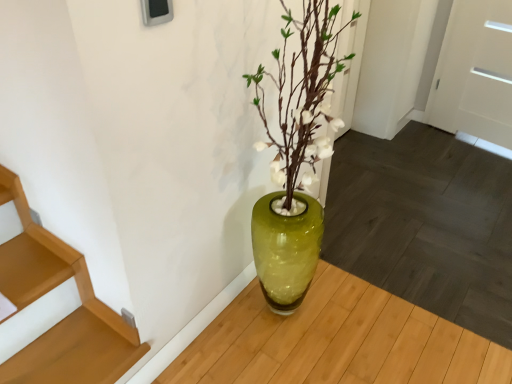
Question: Looking at the image, does wooden stairs at lower left seem bigger or smaller compared to white matte door at upper right?

Choices:
 (A) big
 (B) small

Answer: (B)

Question: Is wooden stairs at lower left in front of or behind white matte door at upper right in the image?

Choices:
 (A) behind
 (B) front

Answer: (B)

Question: Considering the relative positions of wooden stairs at lower left and white matte door at upper right in the image provided, is wooden stairs at lower left to the left or to the right of white matte door at upper right?

Choices:
 (A) right
 (B) left

Answer: (B)

Question: Is point (490, 125) closer or farther from the camera than point (95, 342)?

Choices:
 (A) farther
 (B) closer

Answer: (A)

Question: In the image, is white matte door at upper right positioned in front of or behind wooden stairs at lower left?

Choices:
 (A) behind
 (B) front

Answer: (A)

Question: Looking at their shapes, would you say white matte door at upper right is wider or thinner than wooden stairs at lower left?

Choices:
 (A) wide
 (B) thin

Answer: (B)

Question: From the image's perspective, is white matte door at upper right above or below wooden stairs at lower left?

Choices:
 (A) below
 (B) above

Answer: (B)